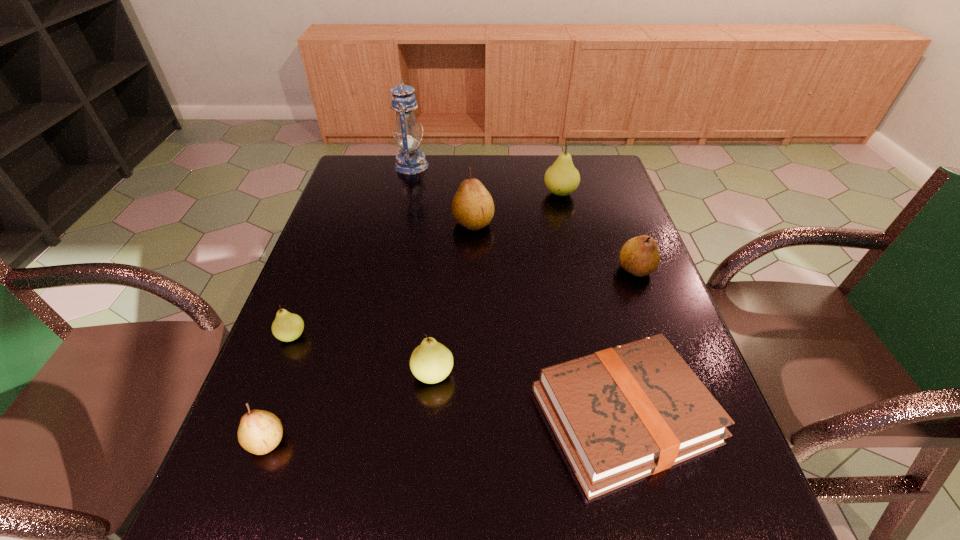
In the image, there is a desktop. At what (x,y) coordinates should I click in order to perform the action: click on vacant space at the near edge. Please return your answer as a coordinate pair (x, y). Image resolution: width=960 pixels, height=540 pixels. Looking at the image, I should click on (341, 508).

This screenshot has width=960, height=540. Find the location of `blank area at the left edge`. blank area at the left edge is located at coordinates pos(352,242).

Where is `free region at the right edge`? free region at the right edge is located at coordinates (712, 467).

Identify the location of vacant space at the far left corner of the desktop. The width and height of the screenshot is (960, 540). (373, 184).

Identify the location of vacant space at the far right corner of the desktop. This screenshot has width=960, height=540. (595, 167).

At what (x,y) coordinates should I click in order to perform the action: click on unoccupied area between the rightmost green pear and the hardback book. Please return your answer as a coordinate pair (x, y). Image resolution: width=960 pixels, height=540 pixels. Looking at the image, I should click on (591, 304).

You are a GUI agent. You are given a task and a screenshot of the screen. Output one action in this format:
    pyautogui.click(x=<x>, y=<y>)
    Task: Click on the free area in between the leftmost green pear and the fourth nearest pear
    The height and width of the screenshot is (540, 960).
    Given the screenshot: What is the action you would take?
    pyautogui.click(x=464, y=303)

Find the location of a particular element. The width and height of the screenshot is (960, 540). free space between the second nearest pear and the nearest pear is located at coordinates (349, 408).

This screenshot has height=540, width=960. In order to click on empty space between the farthest brown pear and the second farthest object in this screenshot , I will do `click(516, 208)`.

Where is `blank region between the shortest object and the fifth nearest pear`? Image resolution: width=960 pixels, height=540 pixels. blank region between the shortest object and the fifth nearest pear is located at coordinates (548, 319).